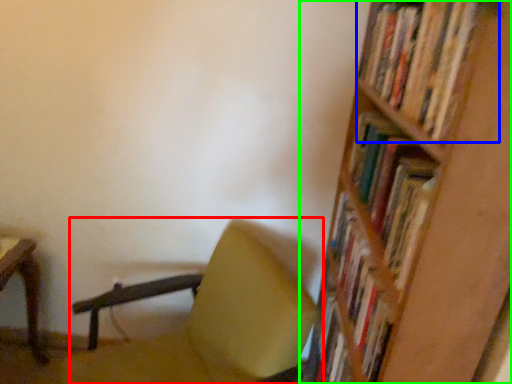
Question: Considering the real-world distances, which object is farthest from chair (highlighted by a red box)? book (highlighted by a blue box) or shelf (highlighted by a green box)?

Choices:
 (A) book
 (B) shelf

Answer: (A)